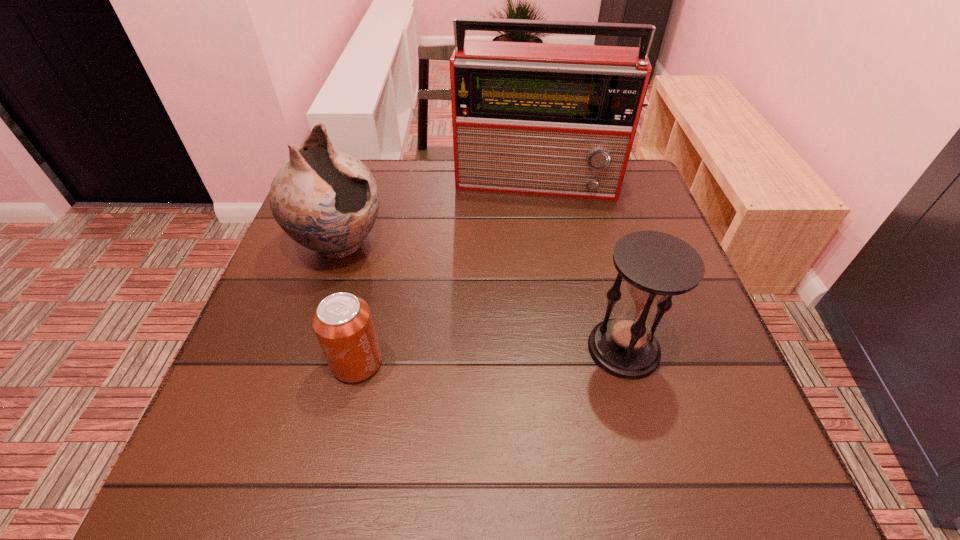
I want to click on the shortest object, so click(x=342, y=322).

You are a GUI agent. You are given a task and a screenshot of the screen. Output one action in this format:
    pyautogui.click(x=<x>, y=<y>)
    Task: Click on the second shortest object
    
    Given the screenshot: What is the action you would take?
    pyautogui.click(x=656, y=266)

You are a GUI agent. You are given a task and a screenshot of the screen. Output one action in this format:
    pyautogui.click(x=<x>, y=<y>)
    Task: Click on the pottery
    
    Given the screenshot: What is the action you would take?
    pyautogui.click(x=327, y=200)

At what (x,y) coordinates should I click in order to perform the action: click on the third nearest object. Please return your answer as a coordinate pair (x, y). Looking at the image, I should click on (327, 200).

Identify the location of the tallest object. (547, 119).

You are a GUI agent. You are given a task and a screenshot of the screen. Output one action in this format:
    pyautogui.click(x=<x>, y=<y>)
    Task: Click on the radio receiver
    
    Given the screenshot: What is the action you would take?
    pyautogui.click(x=547, y=119)

At what (x,y) coordinates should I click in order to perform the action: click on vacant space situated on the back of the shortest object. Please return your answer as a coordinate pair (x, y). The image size is (960, 540). Looking at the image, I should click on (368, 314).

In order to click on vacant space situated on the back of the hourglass in this screenshot , I will do `click(587, 214)`.

Where is `vacant space located from the spout of the third shortest object`? Image resolution: width=960 pixels, height=540 pixels. vacant space located from the spout of the third shortest object is located at coordinates (490, 336).

You are a GUI agent. You are given a task and a screenshot of the screen. Output one action in this format:
    pyautogui.click(x=<x>, y=<y>)
    Task: Click on the vacant region located from the spout of the third shortest object
    Image resolution: width=960 pixels, height=540 pixels.
    Given the screenshot: What is the action you would take?
    pyautogui.click(x=482, y=331)